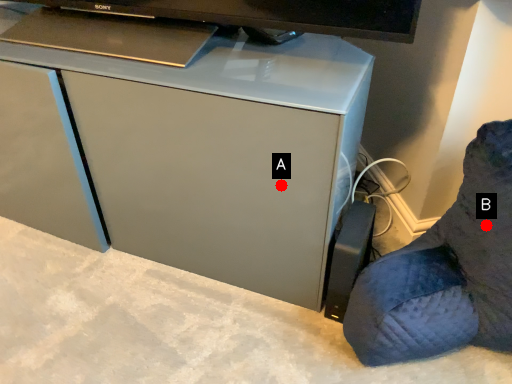
Question: Two points are circled on the image, labeled by A and B beside each circle. Which point is further to the camera?

Choices:
 (A) A is further
 (B) B is further

Answer: (A)